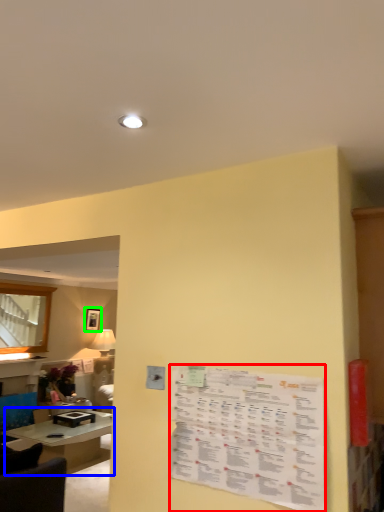
Question: Which object is positioned closest to menu (highlighted by a red box)? Select from table (highlighted by a blue box) and picture frame (highlighted by a green box).

Choices:
 (A) table
 (B) picture frame

Answer: (A)